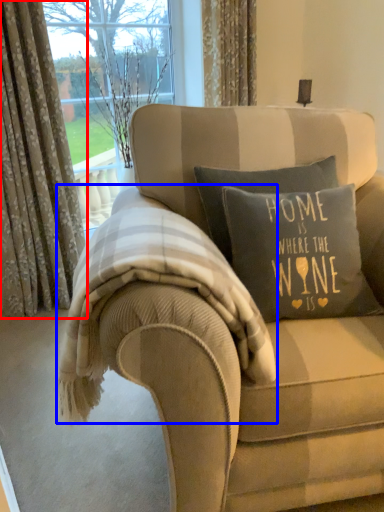
Question: Among these objects, which one is farthest to the camera, curtain (highlighted by a red box) or bedding (highlighted by a blue box)?

Choices:
 (A) curtain
 (B) bedding

Answer: (A)